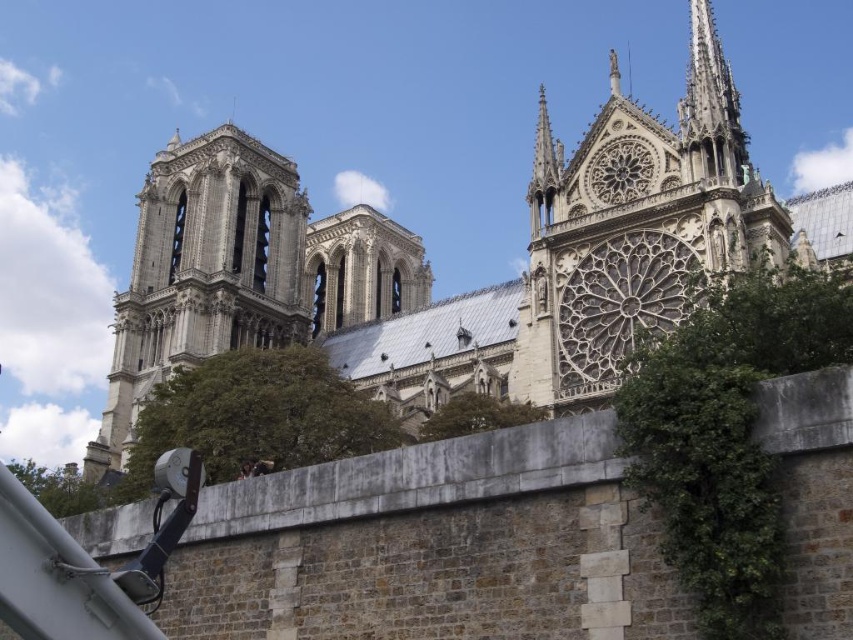
Based on the photo, between white stone church at center and smooth stone spire at upper right, which one has less height?

smooth stone spire at upper right is shorter.

Does white stone church at center lie behind smooth stone spire at upper right?

No, it is in front of smooth stone spire at upper right.

Is point (427, 336) closer to viewer compared to point (720, 67)?

No, (427, 336) is behind (720, 67).

Where is `white stone church at center`? The height and width of the screenshot is (640, 853). white stone church at center is located at coordinates (431, 273).

Who is lower down, white stone church at center or white stone rose window at upper right?

white stone church at center is below.

Is white stone church at center positioned in front of white stone rose window at upper right?

No, it is not.

This screenshot has height=640, width=853. In order to click on white stone church at center in this screenshot , I will do `click(431, 273)`.

The image size is (853, 640). I want to click on white stone church at center, so click(431, 273).

Can you confirm if white stone rose window at upper right is positioned to the right of smooth stone spire at upper right?

Incorrect, white stone rose window at upper right is not on the right side of smooth stone spire at upper right.

Can you confirm if white stone rose window at upper right is bigger than smooth stone spire at upper right?

Incorrect, white stone rose window at upper right is not larger than smooth stone spire at upper right.

Identify the location of white stone rose window at upper right. (634, 227).